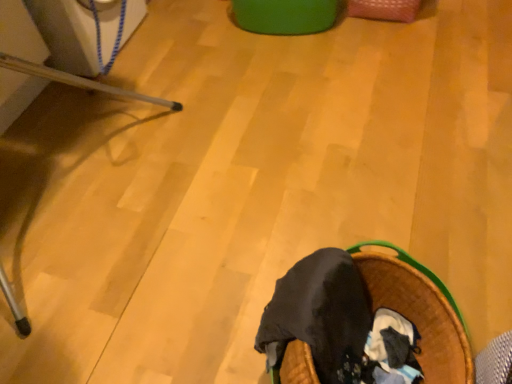
You are a GUI agent. You are given a task and a screenshot of the screen. Output one action in this format:
    pyautogui.click(x=<x>, y=<y>)
    Task: Click on the dark fabric laundry basket at lower center
    The width and height of the screenshot is (512, 384).
    Given the screenshot: What is the action you would take?
    pyautogui.click(x=415, y=270)

This screenshot has width=512, height=384. What do you see at coordinates (415, 270) in the screenshot?
I see `dark fabric laundry basket at lower center` at bounding box center [415, 270].

Image resolution: width=512 pixels, height=384 pixels. In order to click on dark fabric laundry basket at lower center in this screenshot , I will do `click(415, 270)`.